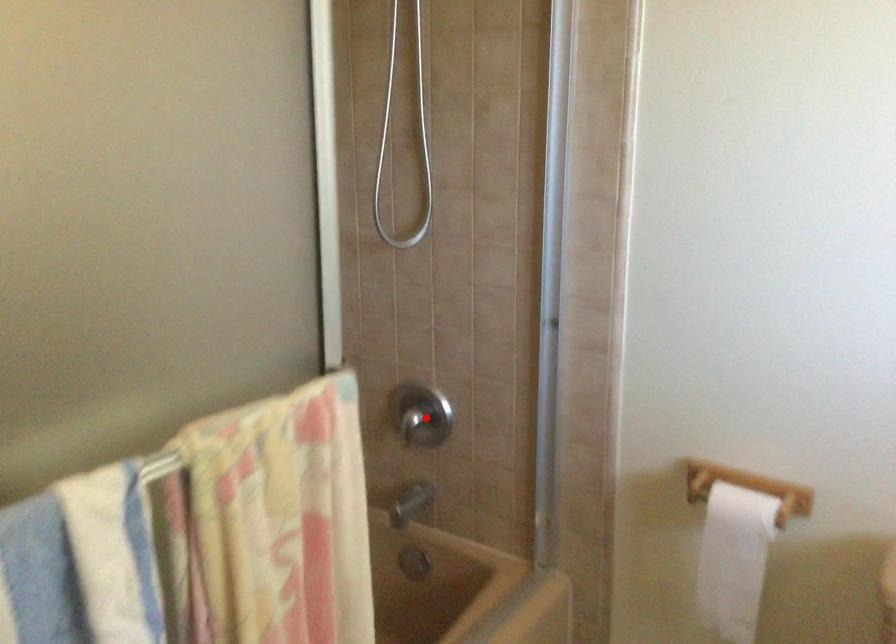
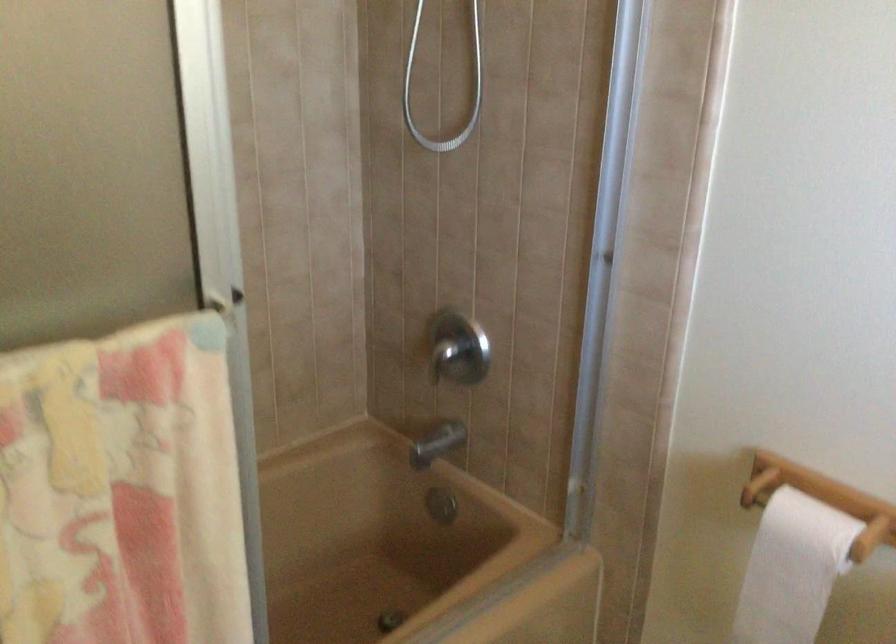
Locate, in the second image, the point that corresponds to the highlighted location in the first image.

(458, 348)